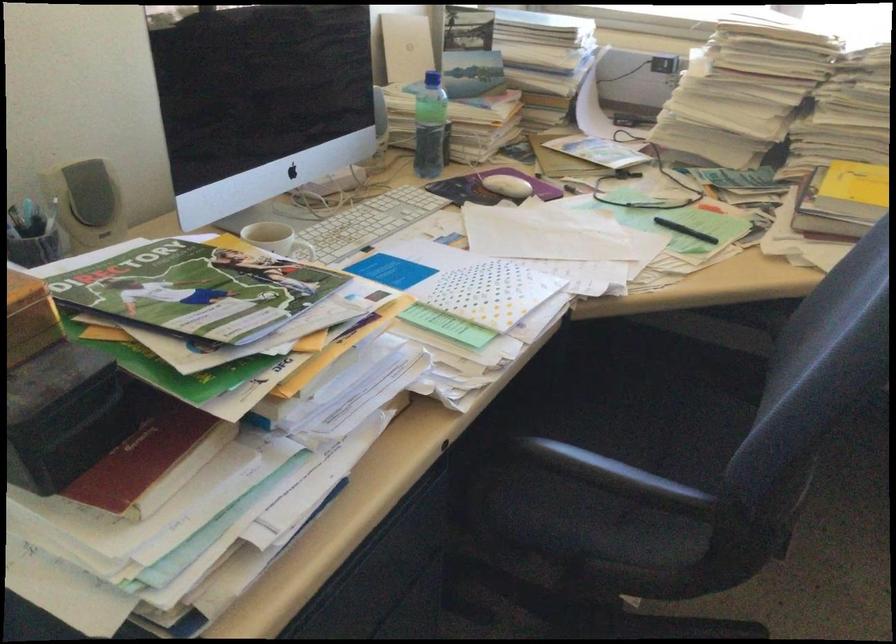
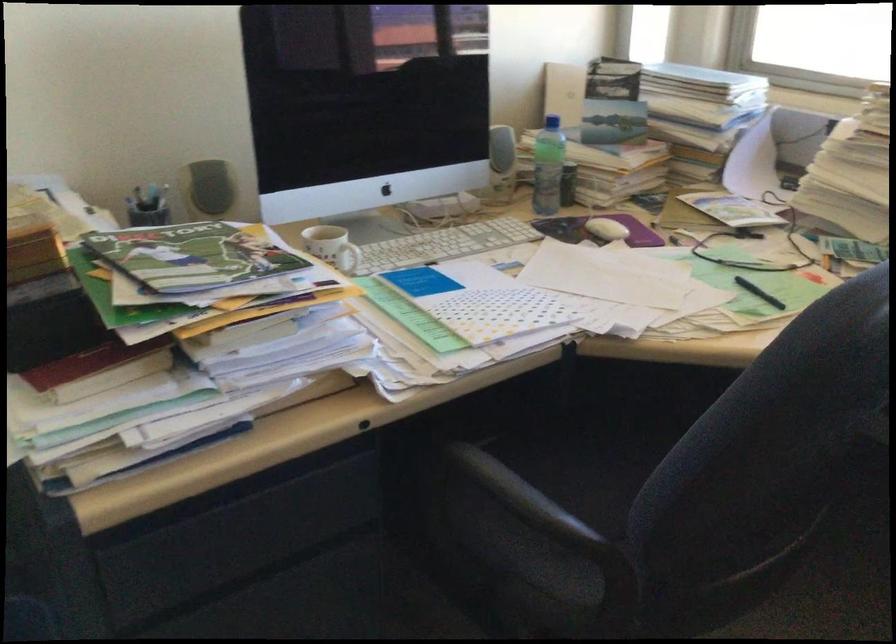
Question: I am providing you with two images of the same scene from different viewpoints. Please identify which objects are invisible in image2.

Choices:
 (A) chair sitting surface
 (B) patterned sofa blanket
 (C) green water bottle
 (D) white mug handle

Answer: (A)